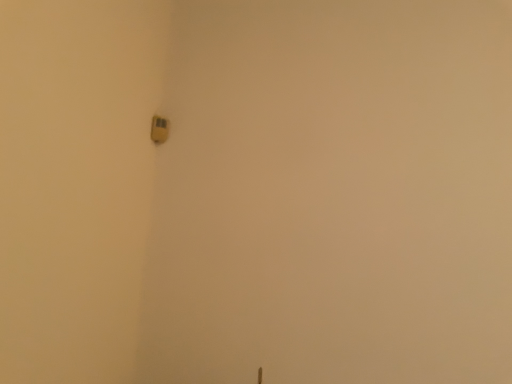
Measure the distance between yellow plastic power plug at upper left and camera.

6.28 feet.

The image size is (512, 384). What do you see at coordinates (159, 129) in the screenshot?
I see `yellow plastic power plug at upper left` at bounding box center [159, 129].

Where is `yellow plastic power plug at upper left`? This screenshot has width=512, height=384. yellow plastic power plug at upper left is located at coordinates (159, 129).

Where is `yellow plastic power plug at upper left`? This screenshot has height=384, width=512. yellow plastic power plug at upper left is located at coordinates (159, 129).